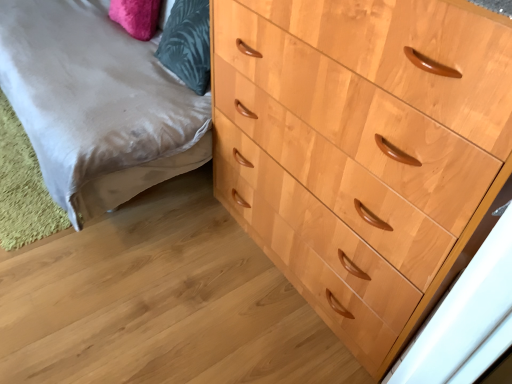
What is the approximate width of wooden dresser at right?

wooden dresser at right is 1.12 meters in width.

The height and width of the screenshot is (384, 512). What do you see at coordinates (96, 105) in the screenshot?
I see `wooden dresser at right` at bounding box center [96, 105].

At what (x,y) coordinates should I click in order to perform the action: click on wooden dresser at right. Please return your answer as a coordinate pair (x, y). The width and height of the screenshot is (512, 384). Looking at the image, I should click on 96,105.

Locate an element on the screen. This screenshot has height=384, width=512. wooden dresser at right is located at coordinates (96, 105).